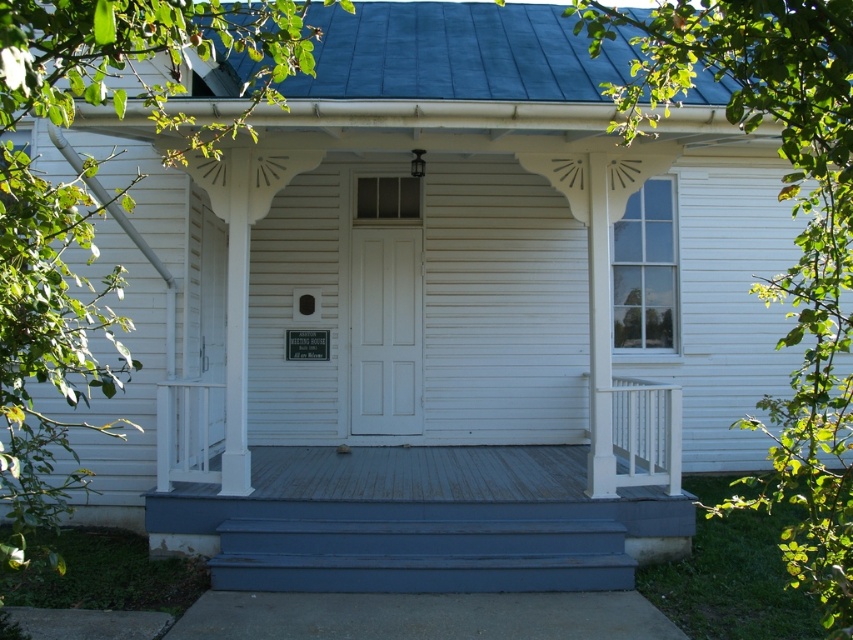
You are a painter who needs to decide which area to paint first. Based on the scene, which object between the blue painted wood stairs at lower center and the white painted wood door at center requires more paint due to its size?

The blue painted wood stairs at lower center requires more paint because it is larger in size than the white painted wood door at center.